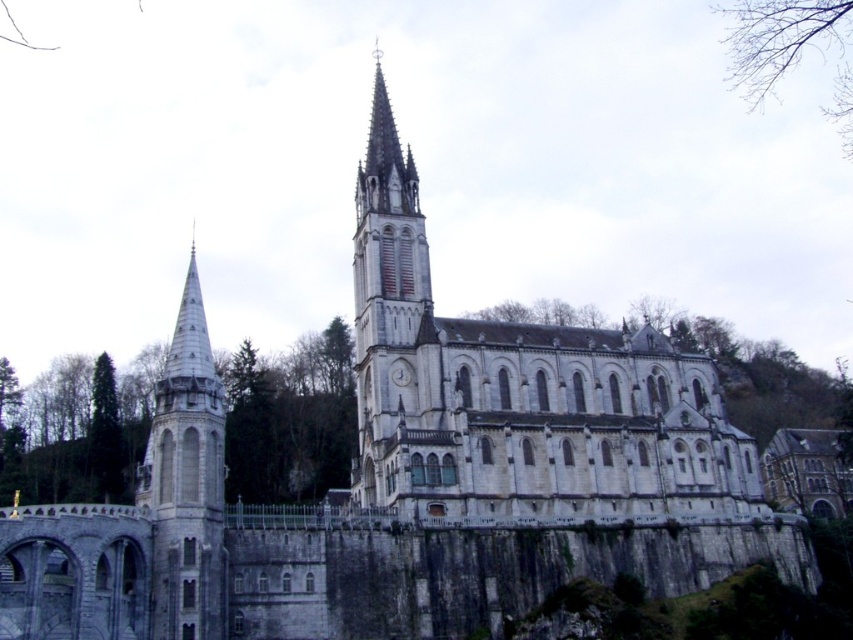
You are standing on the hillside looking at the white stone church at center and the green leafy tree at center. Which object is closer to the right edge of the image?

The white stone church at center is positioned on the right side of green leafy tree at center, so it is closer to the right edge of the image.

You are standing at the bottom of the hill looking up at the white stone church at center and the green leafy tree at center. Which object appears larger in your view?

The white stone church at center appears larger because it is closer to the viewer than the green leafy tree at center.

You are standing at the base of the grand church and want to take a photo of the white stone spire at left. According to the coordinates provided, where should you position yourself to capture the spire in your frame?

The white stone spire at left is located at point [186,481], so you should position yourself at the base of the church facing towards the left side of the building to capture the spire in your frame.